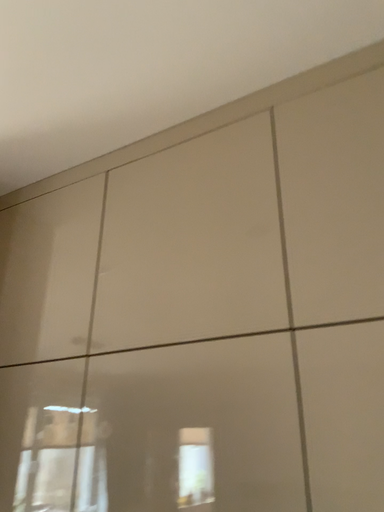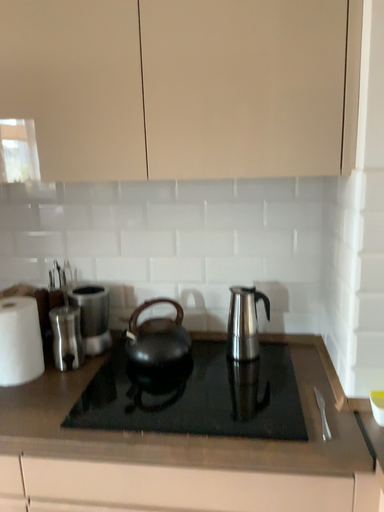
Question: How did the camera likely rotate when shooting the video?

Choices:
 (A) rotated downward
 (B) rotated upward

Answer: (A)